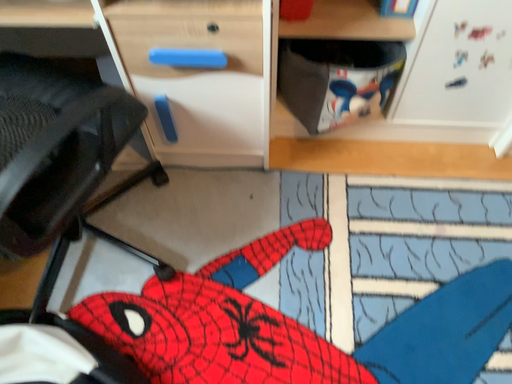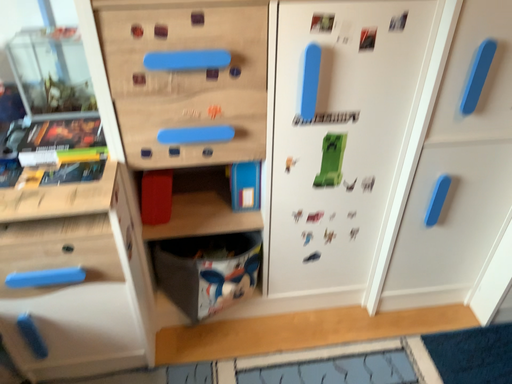
Question: How did the camera likely rotate when shooting the video?

Choices:
 (A) rotated right
 (B) rotated left

Answer: (A)